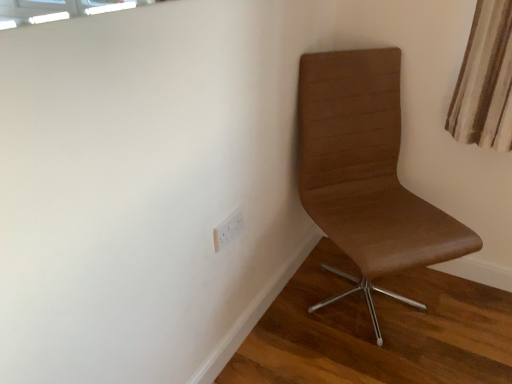
Where is `vacant location below brown leather chair at right (from a real-world perspective)`? vacant location below brown leather chair at right (from a real-world perspective) is located at coordinates (364, 302).